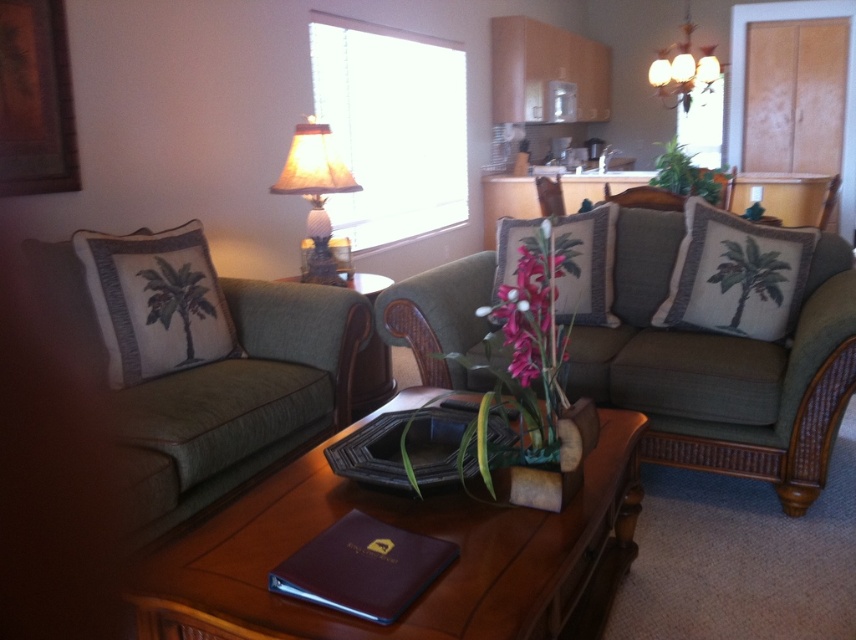
Question: Which point is closer to the camera?

Choices:
 (A) (188, 336)
 (B) (800, 243)
 (C) (836, 196)

Answer: (A)

Question: Estimate the real-world distances between objects in this image. Which object is farther from the textured palm tree pillow at left?

Choices:
 (A) pink silk flower at center
 (B) rattan chair at center

Answer: (B)

Question: Which of the following is the closest to the observer?

Choices:
 (A) rattan side table at center
 (B) rattan chair at center
 (C) matte beige lampshade at upper center

Answer: (A)

Question: Can you confirm if brown wood table at center is wider than maroon leather binder at center?

Choices:
 (A) yes
 (B) no

Answer: (A)

Question: Can you confirm if green fabric couch at left is positioned to the left of pink silk flower at center?

Choices:
 (A) yes
 (B) no

Answer: (A)

Question: Is the position of matte beige lampshade at upper center more distant than that of rattan chair at center?

Choices:
 (A) yes
 (B) no

Answer: (B)